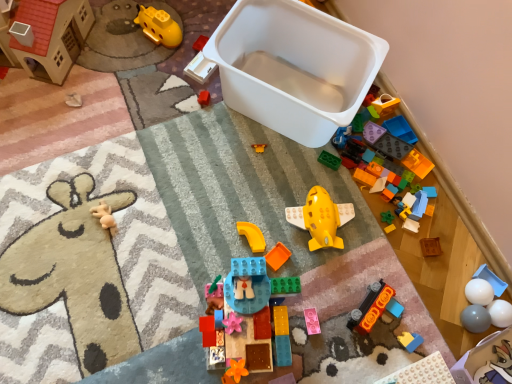
The image size is (512, 384). I want to click on vacant area located to the right-hand side of matte plastic toy at lower right, the 5th toy viewed from the right, so click(x=439, y=355).